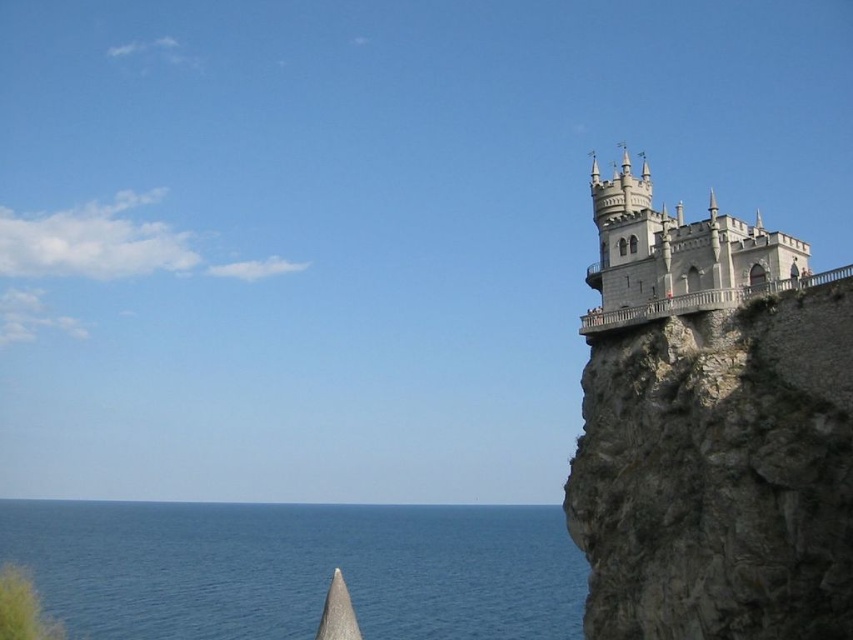
Question: Which object is closer to the camera taking this photo?

Choices:
 (A) white stone castle at upper right
 (B) blue water at lower left

Answer: (A)

Question: Which of the following is the closest to the observer?

Choices:
 (A) white stone castle at upper right
 (B) blue water at lower left

Answer: (A)

Question: Which point is closer to the camera?

Choices:
 (A) gray rocky cliff at right
 (B) white stone castle at upper right
 (C) blue water at lower left

Answer: (A)

Question: Can you confirm if gray rocky cliff at right is bigger than white stone castle at upper right?

Choices:
 (A) no
 (B) yes

Answer: (B)

Question: Is gray rocky cliff at right to the left of white stone castle at upper right from the viewer's perspective?

Choices:
 (A) no
 (B) yes

Answer: (B)

Question: Does gray rocky cliff at right appear on the right side of blue water at lower left?

Choices:
 (A) yes
 (B) no

Answer: (A)